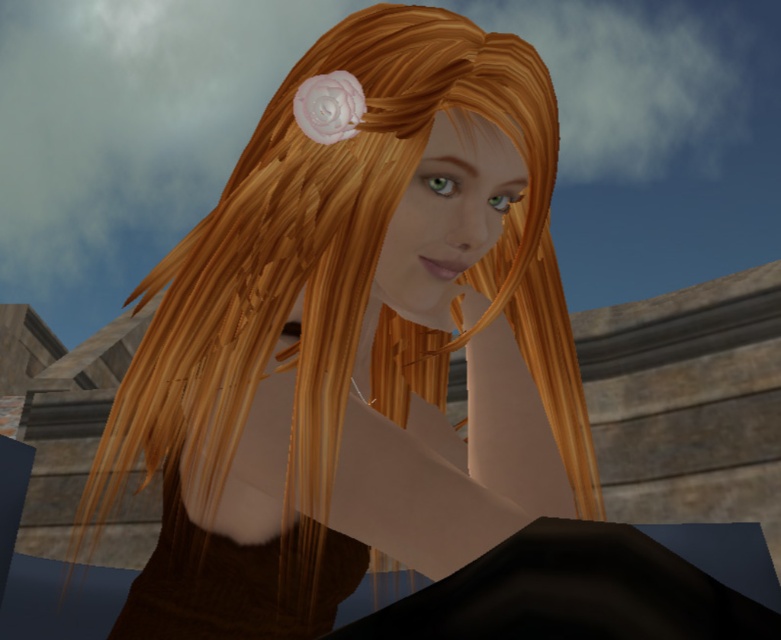
Question: Does shiny brown hair at center have a greater width compared to white matte flower at upper center?

Choices:
 (A) no
 (B) yes

Answer: (B)

Question: Which object is positioned farthest from the brown textured dress at center?

Choices:
 (A) white matte flower at upper center
 (B) shiny brown hair at center

Answer: (A)

Question: Can you confirm if shiny brown hair at center is bigger than brown textured dress at center?

Choices:
 (A) no
 (B) yes

Answer: (B)

Question: Which point is closer to the camera taking this photo?

Choices:
 (A) (346, 90)
 (B) (216, 616)

Answer: (A)

Question: Does shiny brown hair at center have a smaller size compared to brown textured dress at center?

Choices:
 (A) no
 (B) yes

Answer: (A)

Question: Which of these objects is positioned farthest from the brown textured dress at center?

Choices:
 (A) white matte flower at upper center
 (B) shiny brown hair at center

Answer: (A)